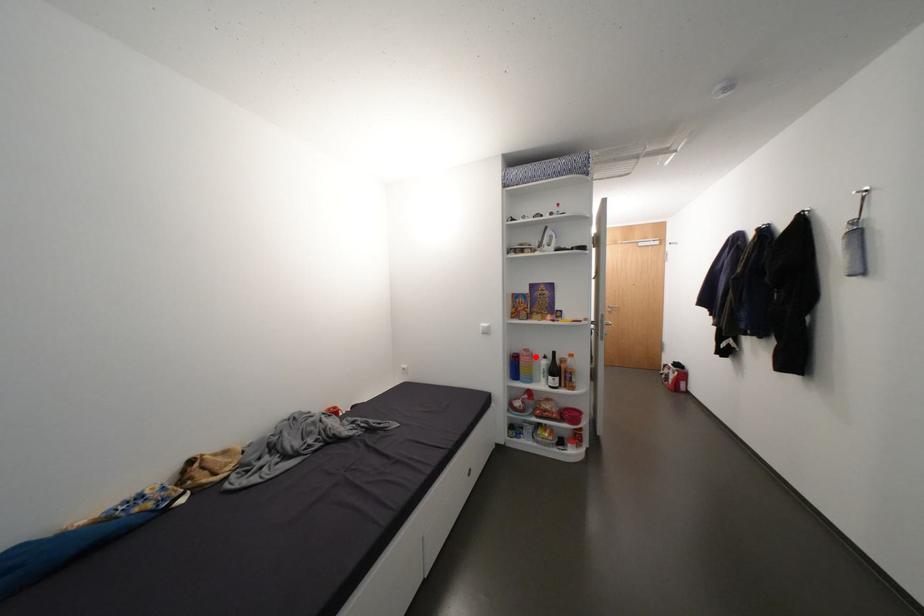
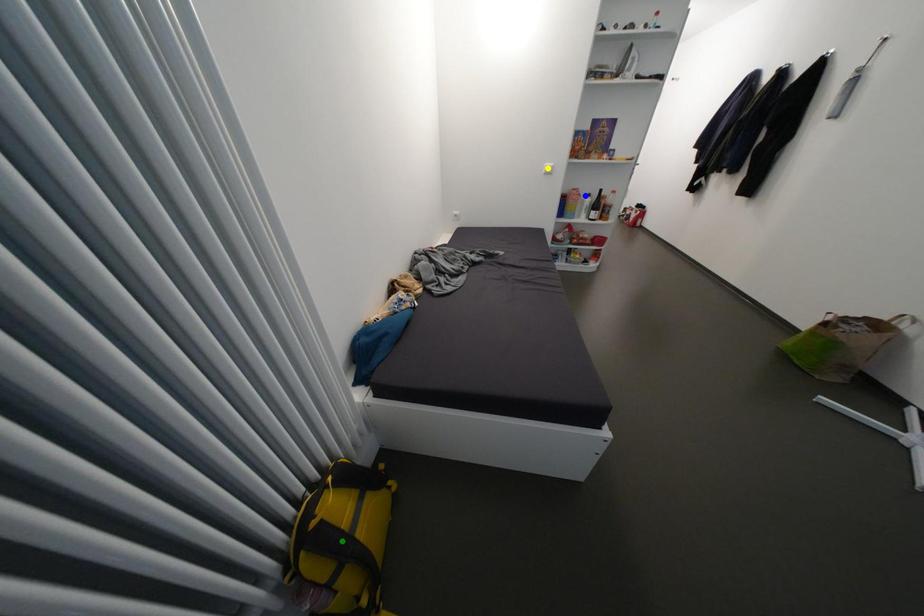
Question: I am providing you with two images of the same scene from different viewpoints. A red point is marked on the first image. You are given multiple points on the second image. Which point in image 2 represents the same 3d spot as the red point in image 1?

Choices:
 (A) green point
 (B) yellow point
 (C) blue point

Answer: (C)